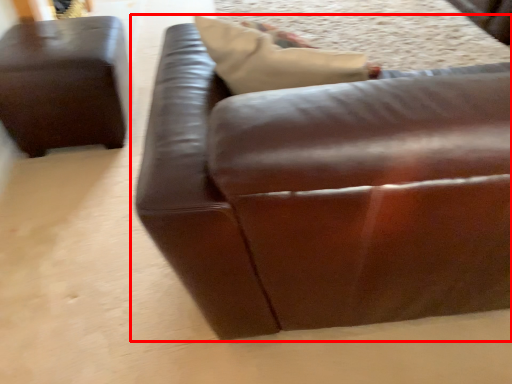
Question: Considering the relative positions of studio couch (annotated by the red box) and studio couch in the image provided, where is studio couch (annotated by the red box) located with respect to the staircase?

Choices:
 (A) left
 (B) right

Answer: (B)